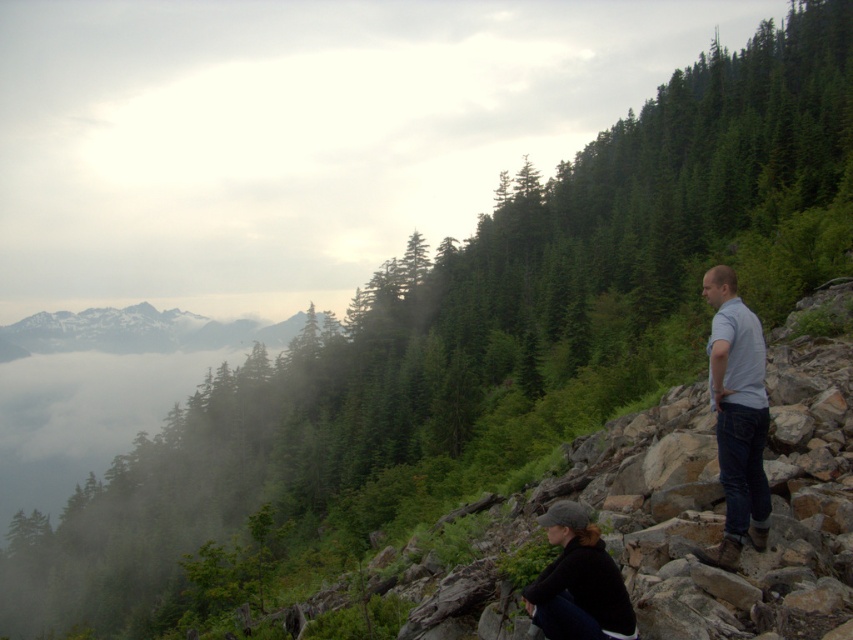
Question: Which point is farther to the camera?

Choices:
 (A) (64, 339)
 (B) (732, 474)
 (C) (616, 566)

Answer: (A)

Question: Which object is positioned farthest from the dark gray woolen cap at lower center?

Choices:
 (A) snowy rock mountain at upper left
 (B) light blue denim jeans at right

Answer: (A)

Question: Which point appears farthest from the camera in this image?

Choices:
 (A) [630, 605]
 (B) [50, 330]

Answer: (B)

Question: Does light blue denim jeans at right have a lesser width compared to snowy rock mountain at upper left?

Choices:
 (A) no
 (B) yes

Answer: (B)

Question: Can you confirm if light blue denim jeans at right is thinner than dark gray woolen cap at lower center?

Choices:
 (A) no
 (B) yes

Answer: (A)

Question: Is snowy rock mountain at upper left to the right of dark gray woolen cap at lower center from the viewer's perspective?

Choices:
 (A) yes
 (B) no

Answer: (B)